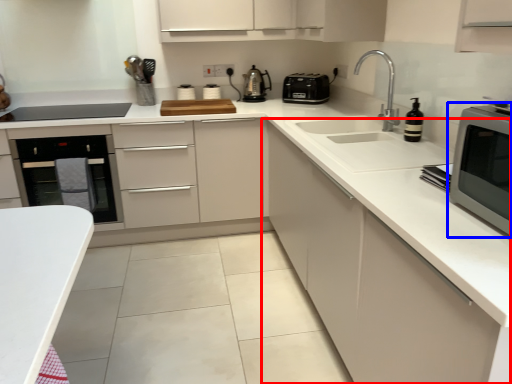
Question: Which object is closer to the camera taking this photo, cabinetry (highlighted by a red box) or home appliance (highlighted by a blue box)?

Choices:
 (A) cabinetry
 (B) home appliance

Answer: (A)